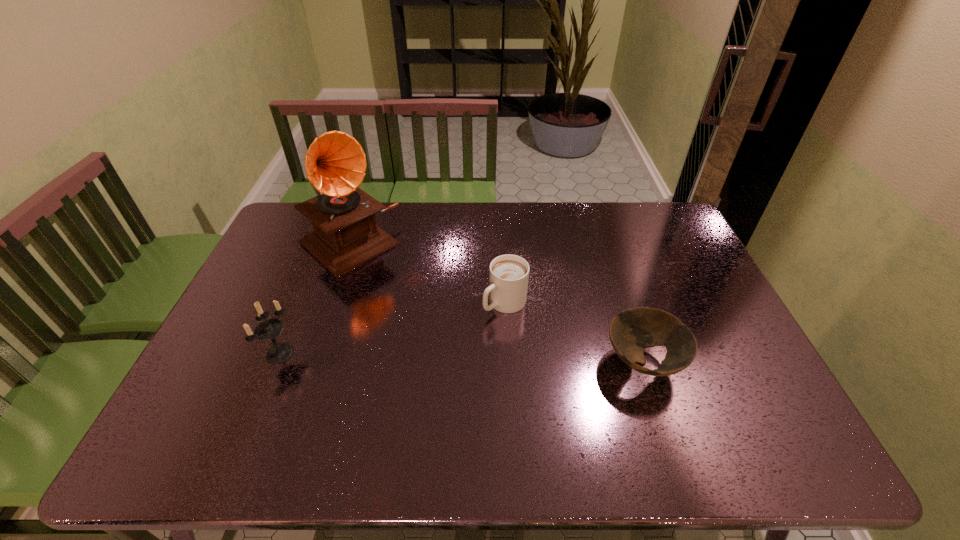
Where is `free spot between the third shortest object and the third object from left to right`? free spot between the third shortest object and the third object from left to right is located at coordinates (393, 328).

Select which object is the third closest to the tallest object. Please provide its 2D coordinates. Your answer should be formatted as a tuple, i.e. [(x, y)], where the tuple contains the x and y coordinates of a point satisfying the conditions above.

[(631, 331)]

Identify which object is the second closest to the third object from left to right. Please provide its 2D coordinates. Your answer should be formatted as a tuple, i.e. [(x, y)], where the tuple contains the x and y coordinates of a point satisfying the conditions above.

[(346, 236)]

At what (x,y) coordinates should I click in order to perform the action: click on vacant space that satisfies the following two spatial constraints: 1. on the front side of the bowl; 2. on the left side of the cappuccino. Please return your answer as a coordinate pair (x, y). Looking at the image, I should click on (508, 362).

At what (x,y) coordinates should I click in order to perform the action: click on vacant space that satisfies the following two spatial constraints: 1. on the front side of the rightmost object; 2. on the left side of the cappuccino. Please return your answer as a coordinate pair (x, y). The image size is (960, 540). Looking at the image, I should click on (508, 362).